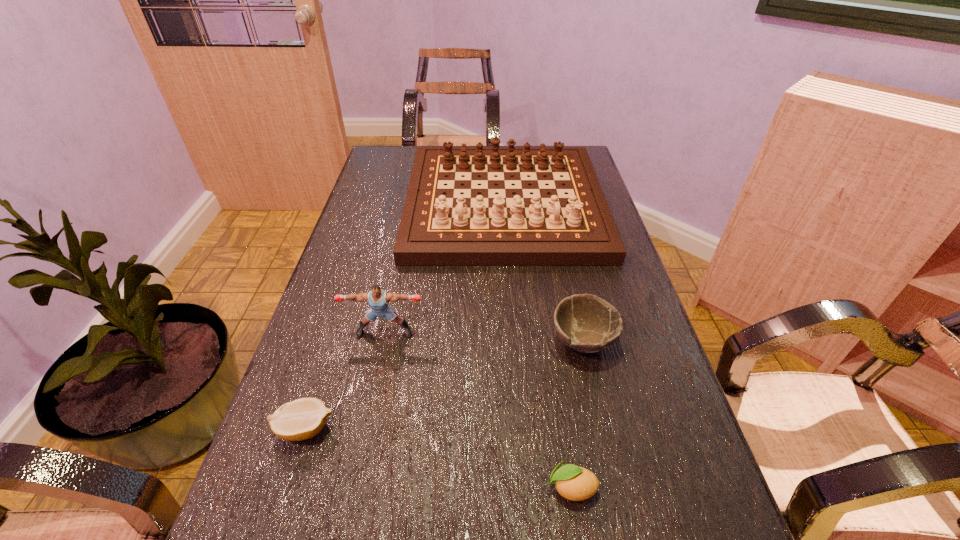
You are a GUI agent. You are given a task and a screenshot of the screen. Output one action in this format:
    pyautogui.click(x=<x>, y=<y>)
    Task: Click on the gameboard
    
    Given the screenshot: What is the action you would take?
    pyautogui.click(x=563, y=219)

Locate an element on the screen. puncher is located at coordinates [x=378, y=299].

I want to click on bowl, so (586, 323).

I want to click on the nearest object, so click(x=574, y=483).

Where is `the nearer lemon`? This screenshot has width=960, height=540. the nearer lemon is located at coordinates (574, 483).

In order to click on the shortest object in this screenshot , I will do `click(301, 419)`.

Where is `the shorter lemon`? The image size is (960, 540). the shorter lemon is located at coordinates (301, 419).

Locate an element on the screen. The height and width of the screenshot is (540, 960). vacant area situated on the side with the white pieces of the farthest object is located at coordinates (512, 304).

Find the location of a particular element. Image resolution: width=960 pixels, height=540 pixels. vacant region located on the front-facing side of the puncher is located at coordinates (375, 376).

Where is `vacant area situated on the left of the bowl`? vacant area situated on the left of the bowl is located at coordinates (491, 341).